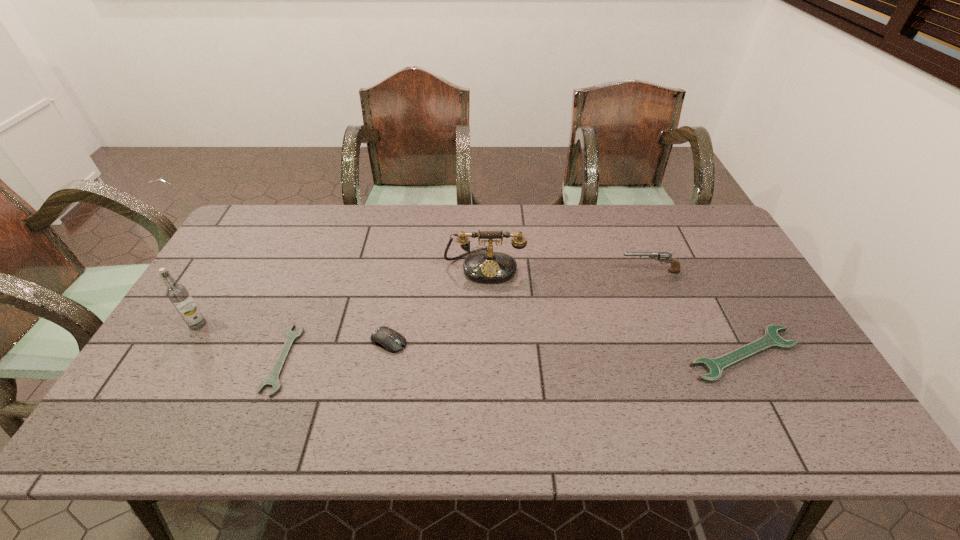
This screenshot has height=540, width=960. In order to click on object at the right edge in this screenshot , I will do `click(771, 339)`.

The width and height of the screenshot is (960, 540). Identify the location of object positioned at the near right corner. (771, 339).

Image resolution: width=960 pixels, height=540 pixels. In the image, there is a desktop. What are the coordinates of `vacant space at the far edge` in the screenshot? It's located at (572, 205).

In the image, there is a desktop. Identify the location of vacant space at the near edge. The image size is (960, 540). (427, 393).

Locate an element on the screen. The width and height of the screenshot is (960, 540). vacant region at the left edge of the desktop is located at coordinates (180, 349).

Locate an element on the screen. vacant area at the right edge of the desktop is located at coordinates (731, 282).

The width and height of the screenshot is (960, 540). What are the coordinates of `free space at the far left corner` in the screenshot? It's located at (249, 248).

In the image, there is a desktop. At what (x,y) coordinates should I click in order to perform the action: click on free space at the near left corner. Please return your answer as a coordinate pair (x, y). This screenshot has height=540, width=960. Looking at the image, I should click on (204, 375).

Find the location of a particular element. This screenshot has width=960, height=540. vacant point at the far right corner is located at coordinates (674, 214).

Where is `vacant region between the third object from right to left and the fourth object from right to left`? The width and height of the screenshot is (960, 540). vacant region between the third object from right to left and the fourth object from right to left is located at coordinates (437, 303).